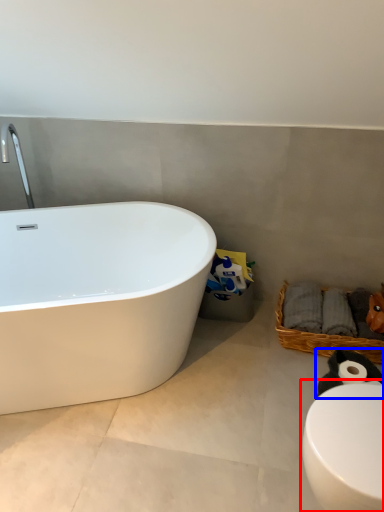
Question: Which point is closer to the camera, toilet (highlighted by a red box) or animal (highlighted by a blue box)?

Choices:
 (A) toilet
 (B) animal

Answer: (A)